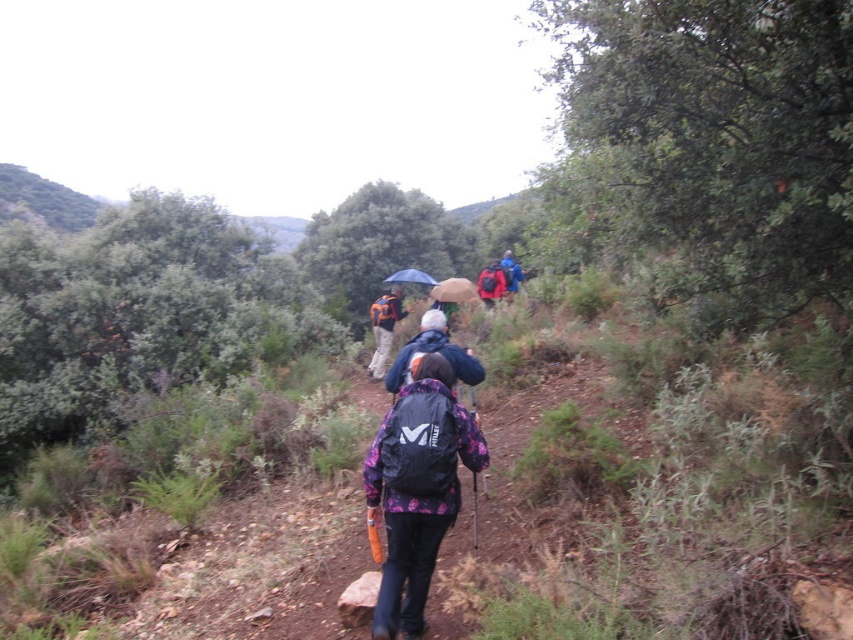
Question: Is the position of matte blue backpack at center more distant than that of blue fabric umbrella at center?

Choices:
 (A) no
 (B) yes

Answer: (B)

Question: Does blue fabric backpack at center have a smaller size compared to blue matte umbrella at center?

Choices:
 (A) yes
 (B) no

Answer: (B)

Question: Which point appears farthest from the camera in this image?

Choices:
 (A) coord(459,276)
 (B) coord(421,333)
 (C) coord(519,276)
 (D) coord(405,272)

Answer: (A)

Question: Among these objects, which one is nearest to the camera?

Choices:
 (A) blue fabric umbrella at center
 (B) orange fabric backpack at center
 (C) blue fabric backpack at center
 (D) blue matte umbrella at center

Answer: (B)

Question: From the image, what is the correct spatial relationship of matte blue backpack at center in relation to blue fabric umbrella at center?

Choices:
 (A) above
 (B) below

Answer: (B)

Question: Which is nearer to the purple fleece jacket at center?

Choices:
 (A) blue fabric backpack at center
 (B) matte blue backpack at center

Answer: (A)